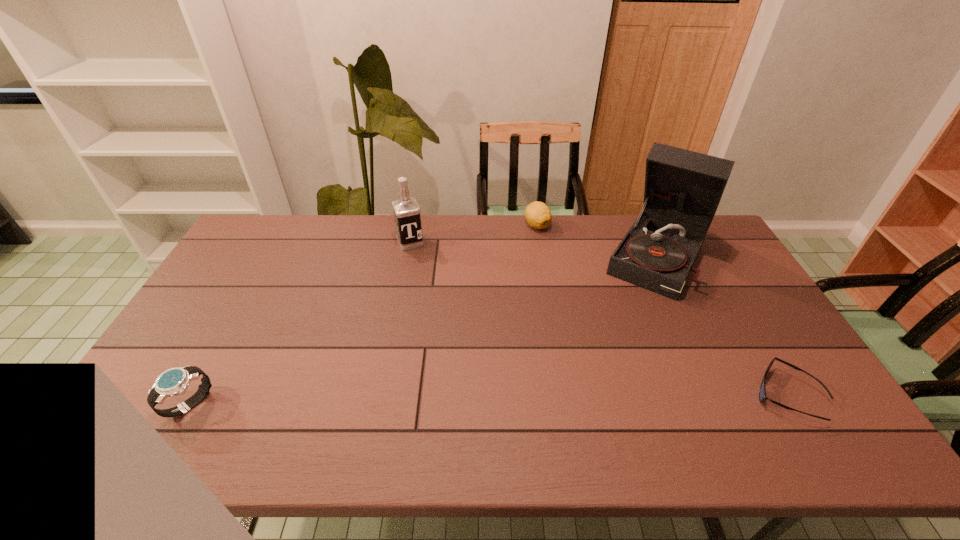
Where is `free space that satisfies the following two spatial constraints: 1. on the back side of the third shortest object; 2. at the front of the sunglasses showing the lenses`? The height and width of the screenshot is (540, 960). free space that satisfies the following two spatial constraints: 1. on the back side of the third shortest object; 2. at the front of the sunglasses showing the lenses is located at coordinates (195, 395).

This screenshot has width=960, height=540. What are the coordinates of `vacant region that satisfies the following two spatial constraints: 1. on the front side of the tallest object; 2. on the right side of the second tallest object` in the screenshot? It's located at (408, 256).